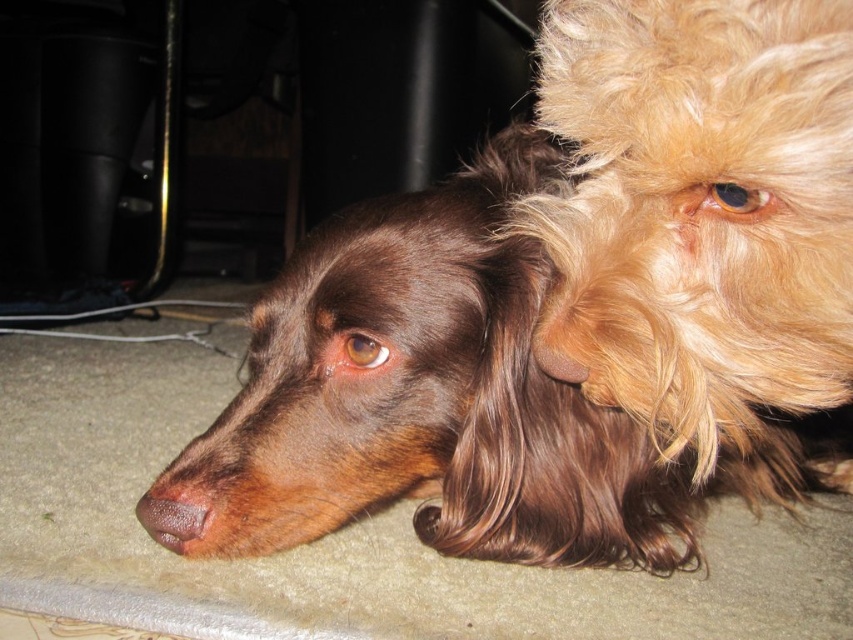
Question: Which point is closer to the camera?

Choices:
 (A) brown shiny fur dog at center
 (B) brown matte nose at lower left

Answer: (A)

Question: Among these objects, which one is nearest to the camera?

Choices:
 (A) brown shiny fur dog at center
 (B) brown matte nose at lower left

Answer: (A)

Question: Among these points, which one is nearest to the camera?

Choices:
 (A) (148, 515)
 (B) (749, 461)

Answer: (A)

Question: Where is brown shiny fur dog at center located in relation to brown matte nose at lower left in the image?

Choices:
 (A) below
 (B) above

Answer: (B)

Question: From the image, what is the correct spatial relationship of brown shiny fur dog at center in relation to brown matte nose at lower left?

Choices:
 (A) above
 (B) below

Answer: (A)

Question: Is brown shiny fur dog at center to the left of brown matte nose at lower left from the viewer's perspective?

Choices:
 (A) no
 (B) yes

Answer: (A)